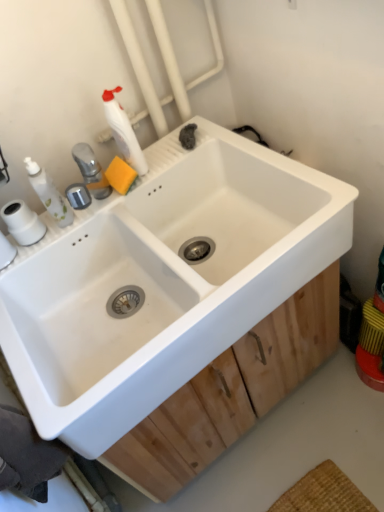
The image size is (384, 512). I want to click on vacant area that is situated to the right of white matte bottle at upper left, so click(184, 152).